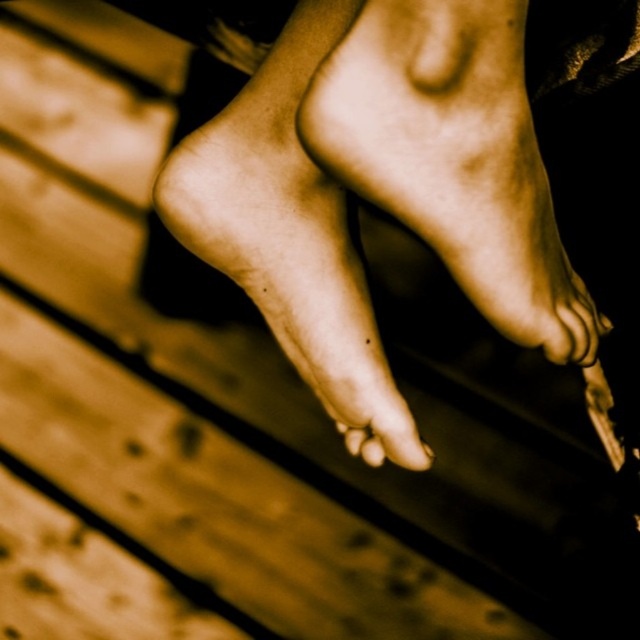
Does smooth skin foot at center come in front of matte skin toe at center?

Yes, smooth skin foot at center is in front of matte skin toe at center.

Is point (524, 326) farther from camera compared to point (368, 460)?

No, it is in front of (368, 460).

Image resolution: width=640 pixels, height=640 pixels. I want to click on smooth skin foot at center, so click(454, 157).

Who is lower down, smooth skin foot at center or smooth skin feet at center?

Positioned lower is smooth skin feet at center.

Which of these two, smooth skin foot at center or smooth skin feet at center, stands taller?

Standing taller between the two is smooth skin feet at center.

Locate an element on the screen. smooth skin foot at center is located at coordinates (454, 157).

This screenshot has width=640, height=640. Identify the location of smooth skin foot at center. (454, 157).

Can you confirm if smooth skin foot at center is bigger than smooth skin toe at center?

Indeed, smooth skin foot at center has a larger size compared to smooth skin toe at center.

Where is `smooth skin foot at center`? This screenshot has width=640, height=640. smooth skin foot at center is located at coordinates (454, 157).

You are a GUI agent. You are given a task and a screenshot of the screen. Output one action in this format:
    pyautogui.click(x=<x>, y=<y>)
    Task: Click on the smooth skin foot at center
    The width and height of the screenshot is (640, 640).
    Given the screenshot: What is the action you would take?
    pyautogui.click(x=454, y=157)